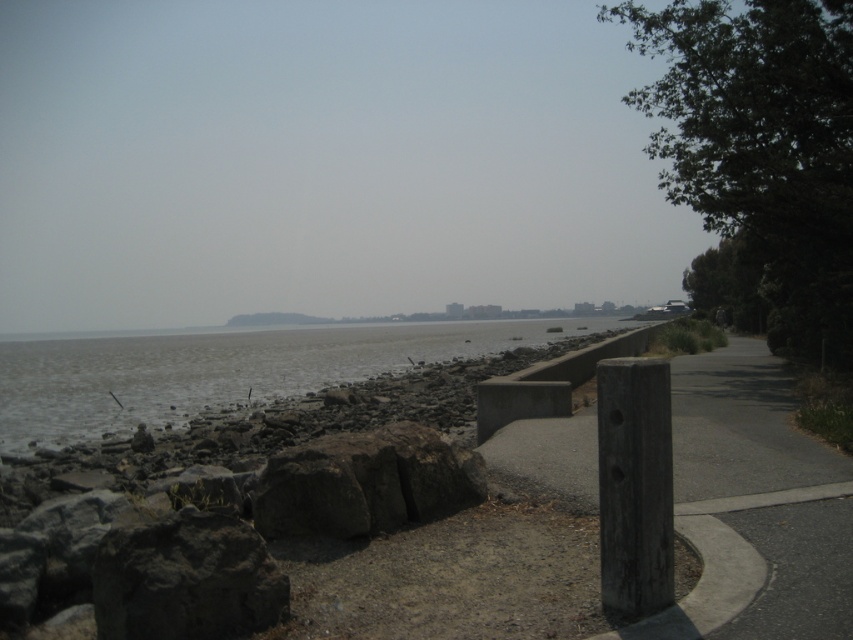
Does gray stone water at center appear under dark gray rock at center?

Correct, gray stone water at center is located below dark gray rock at center.

Between gray stone water at center and dark gray rock at center, which one is positioned lower?

Positioned lower is gray stone water at center.

The height and width of the screenshot is (640, 853). Identify the location of gray stone water at center. (224, 369).

Who is shorter, gray stone water at center or dark gray rough stone at lower left?

Standing shorter between the two is dark gray rough stone at lower left.

Which is below, gray stone water at center or dark gray rough stone at lower left?

Positioned lower is gray stone water at center.

Does point (119, 397) come in front of point (102, 620)?

No, (119, 397) is behind (102, 620).

Locate an element on the screen. This screenshot has width=853, height=640. gray stone water at center is located at coordinates (224, 369).

Which is below, dark gray rough stone at lower left or dark gray rock at center?

dark gray rough stone at lower left

Is point (195, 518) farther from camera compared to point (361, 529)?

No, it is in front of (361, 529).

Which is in front, point (158, 548) or point (287, 468)?

Positioned in front is point (158, 548).

I want to click on dark gray rough stone at lower left, so point(184,579).